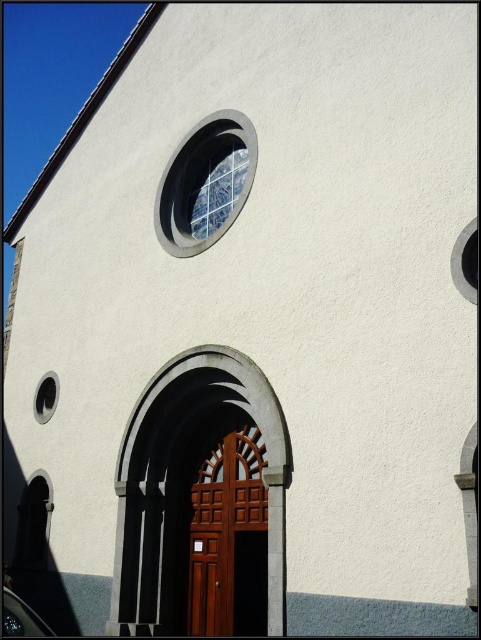
Question: Does clear glass window at upper center have a larger size compared to transparent glass window at lower left?

Choices:
 (A) no
 (B) yes

Answer: (B)

Question: Which point is farther to the camera?

Choices:
 (A) (39, 397)
 (B) (256, 518)
 (C) (206, 204)

Answer: (A)

Question: Which object appears farthest from the camera in this image?

Choices:
 (A) polished wood door at center
 (B) transparent glass window at lower left
 (C) clear glass window at upper center

Answer: (B)

Question: Which is farther from the polished wood door at center?

Choices:
 (A) transparent glass window at lower left
 (B) clear glass window at upper center

Answer: (A)

Question: From the image, what is the correct spatial relationship of polished wood door at center in relation to clear glass window at upper center?

Choices:
 (A) above
 (B) below

Answer: (B)

Question: Does polished wood door at center come in front of clear glass window at upper center?

Choices:
 (A) no
 (B) yes

Answer: (B)